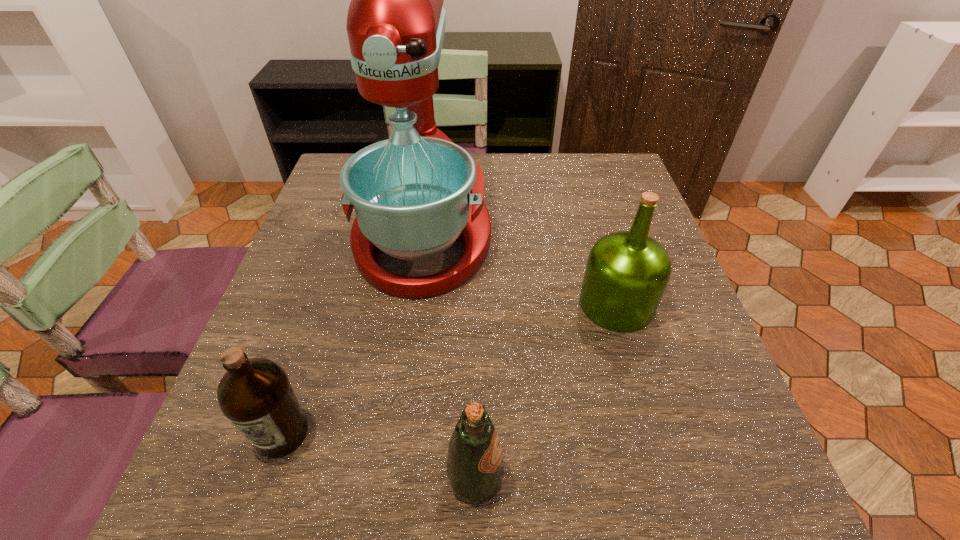
Where is `olive oil at the left edge`? This screenshot has width=960, height=540. olive oil at the left edge is located at coordinates (255, 394).

I want to click on object that is at the right edge, so coord(627,272).

Identify the location of object located in the far left corner section of the desktop. (414, 194).

Find the location of `object that is positioned at the near left corner`. object that is positioned at the near left corner is located at coordinates (255, 394).

In the image, there is a desktop. Where is `free space at the far edge`? This screenshot has width=960, height=540. free space at the far edge is located at coordinates (526, 181).

The width and height of the screenshot is (960, 540). In the image, there is a desktop. What are the coordinates of `free space at the near edge` in the screenshot? It's located at (528, 466).

The image size is (960, 540). I want to click on free point at the left edge, so click(x=319, y=329).

Identify the location of vacant space at the right edge of the desktop. pyautogui.click(x=648, y=347).

Locate an element on the screen. free region at the far left corner of the desktop is located at coordinates (338, 158).

Where is `blank space at the far right corner of the desktop`? blank space at the far right corner of the desktop is located at coordinates (627, 199).